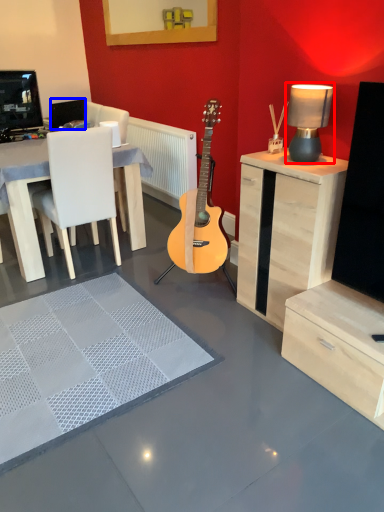
Question: Which of the following is the farthest to the observer, table lamp (highlighted by a red box) or speaker (highlighted by a blue box)?

Choices:
 (A) table lamp
 (B) speaker

Answer: (B)